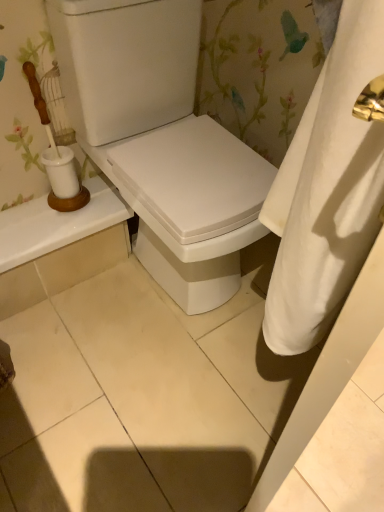
You are a GUI agent. You are given a task and a screenshot of the screen. Output one action in this format:
    pyautogui.click(x=<x>, y=<y>)
    Task: Click on the space that is in front of white glossy toilet at center
    Image resolution: width=384 pixels, height=512 pixels.
    Given the screenshot: What is the action you would take?
    (x=156, y=381)